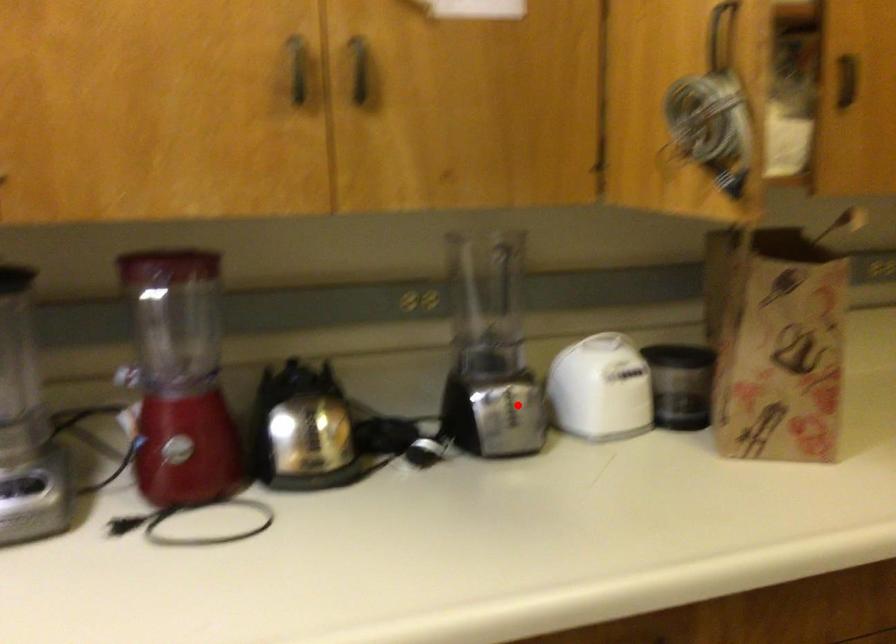
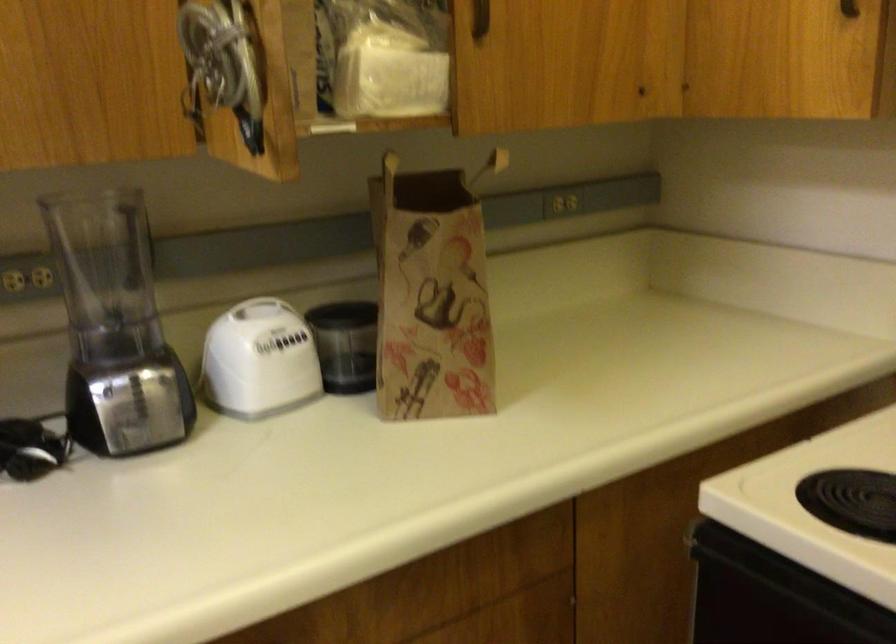
Question: I am providing you with two images of the same scene from different viewpoints. A red point is shown in image1. For the corresponding object point in image2, is it positioned nearer or farther from the camera?

Choices:
 (A) Nearer
 (B) Farther

Answer: (A)